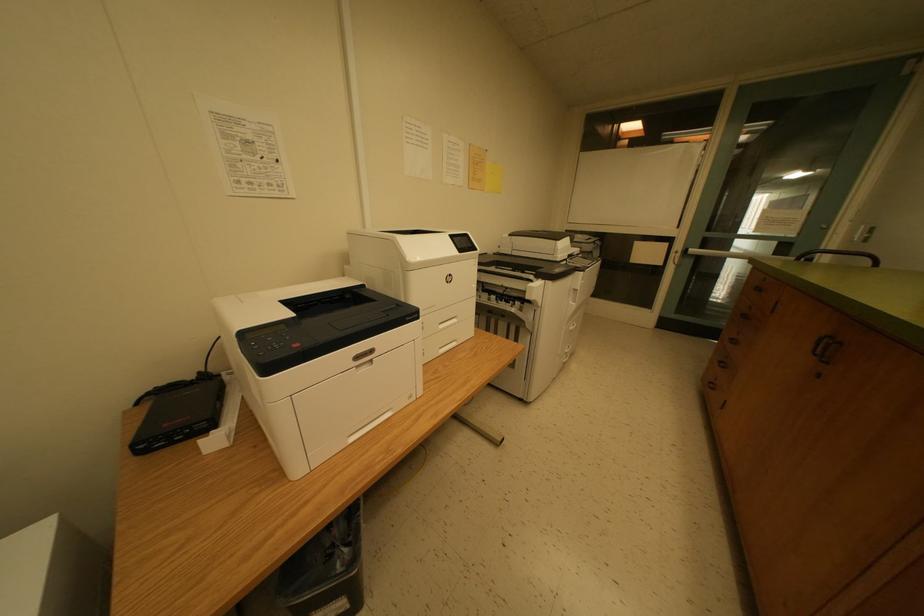
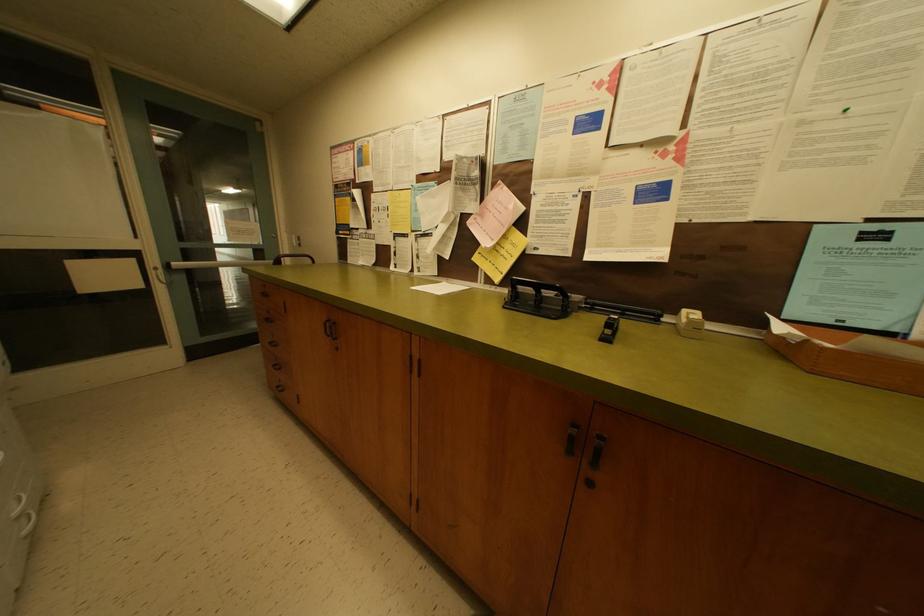
Consider the image. The first image is from the beginning of the video and the second image is from the end. How did the camera likely rotate when shooting the video?

The camera's rotation is toward right-down.